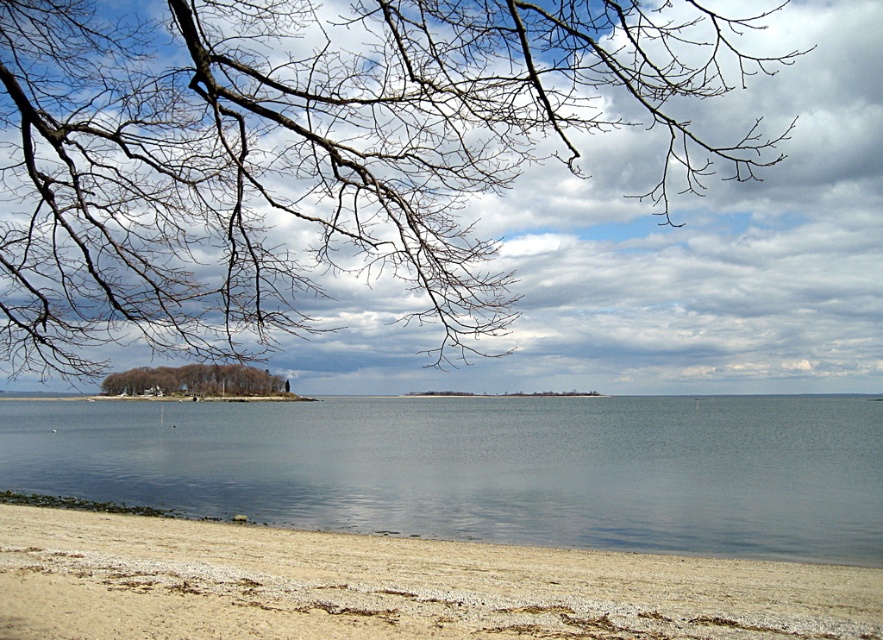
Question: Is light brown sand at lower left positioned behind brown textured island at lower left?

Choices:
 (A) no
 (B) yes

Answer: (B)

Question: Can you confirm if light brown sand at lower left is bigger than brown textured island at lower left?

Choices:
 (A) no
 (B) yes

Answer: (A)

Question: Which object appears closest to the camera in this image?

Choices:
 (A) bare branches at upper left
 (B) clear water at lower center

Answer: (A)

Question: Which of the following is the farthest from the observer?

Choices:
 (A) (282, 465)
 (B) (208, 67)

Answer: (A)

Question: Can you confirm if bare branches at upper left is thinner than clear water at lower center?

Choices:
 (A) no
 (B) yes

Answer: (B)

Question: Which of the following is the farthest from the observer?

Choices:
 (A) (53, 74)
 (B) (208, 566)
 (C) (202, 376)
 (D) (876, 481)

Answer: (C)